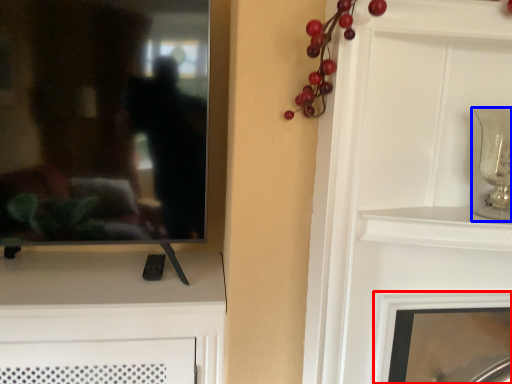
Question: Which object is further to the camera taking this photo, fireplace (highlighted by a red box) or candle holder (highlighted by a blue box)?

Choices:
 (A) fireplace
 (B) candle holder

Answer: (A)